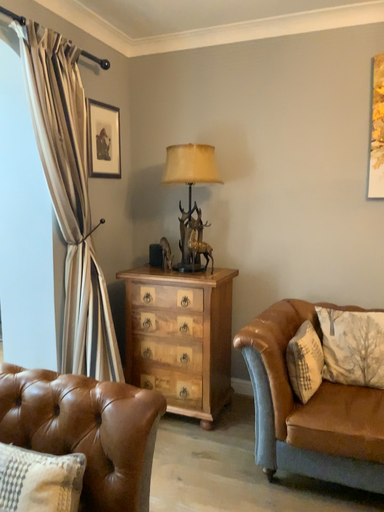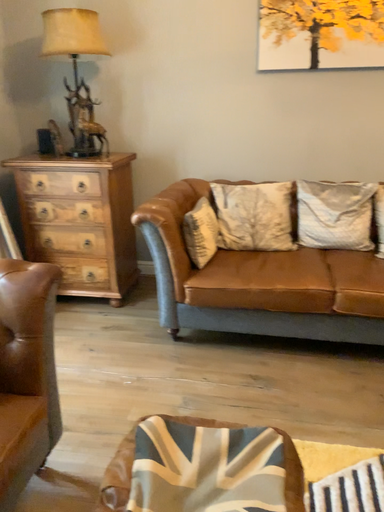
Question: How did the camera likely rotate when shooting the video?

Choices:
 (A) rotated left
 (B) rotated right

Answer: (B)